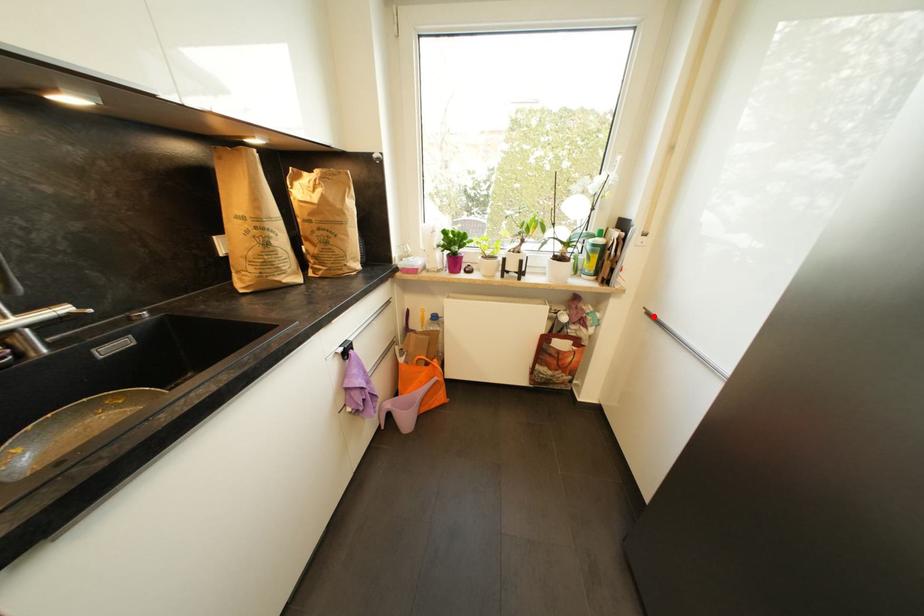
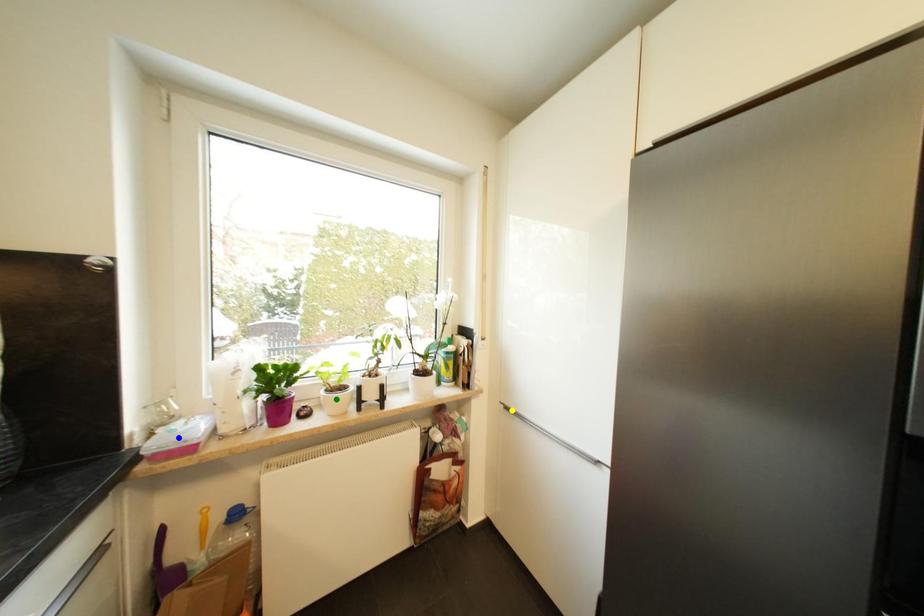
Question: I am providing you with two images of the same scene from different viewpoints. A red point is marked on the first image. You are given multiple points on the second image. Which spot in image 2 lines up with the point in image 1?

Choices:
 (A) blue point
 (B) yellow point
 (C) green point

Answer: (B)